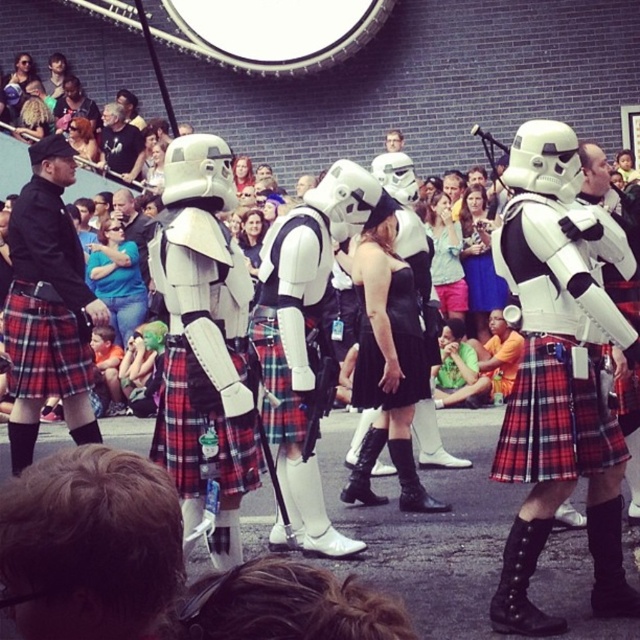
You are a photographer at the event and want to capture both the white matte stormtrooper at center and the black kilt at left in a single photo. Which object should you focus on first to ensure both are in frame?

The white matte stormtrooper at center is shorter than the black kilt at left, so you should focus on the white matte stormtrooper at center first to ensure both are in frame.

You are standing at the point marked as point (x=554, y=348) in the image. What object are you standing on?

You are standing on the white matte stormtrooper at center, which is represented by point (x=554, y=348).

You are at the parade and want to take a photo of both the black kilt at left and the plaid fabric kilt at center. Which kilt should you position to the left side of your camera frame to include both in the photo?

The black kilt at left is already positioned to the left of the plaid fabric kilt at center. To include both in your photo, position the black kilt at left on the left side of your camera frame and the plaid fabric kilt at center in the center.